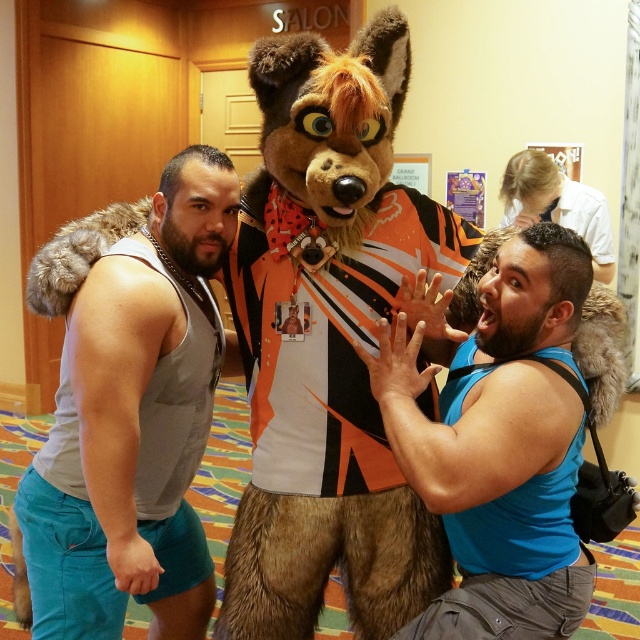
Question: Which point is closer to the camera taking this photo?

Choices:
 (A) (120, 336)
 (B) (454, 436)

Answer: (B)

Question: Among these points, which one is nearest to the camera?

Choices:
 (A) (182, 172)
 (B) (458, 545)

Answer: (B)

Question: Can you confirm if blue fabric shirt at center is thinner than gray fabric tank top at center?

Choices:
 (A) yes
 (B) no

Answer: (A)

Question: Among these objects, which one is nearest to the camera?

Choices:
 (A) gray fabric tank top at center
 (B) blue fabric shirt at center

Answer: (B)

Question: Is the position of blue fabric shirt at center more distant than that of gray fabric tank top at center?

Choices:
 (A) no
 (B) yes

Answer: (A)

Question: Does blue fabric shirt at center appear on the right side of gray fabric tank top at center?

Choices:
 (A) no
 (B) yes

Answer: (B)